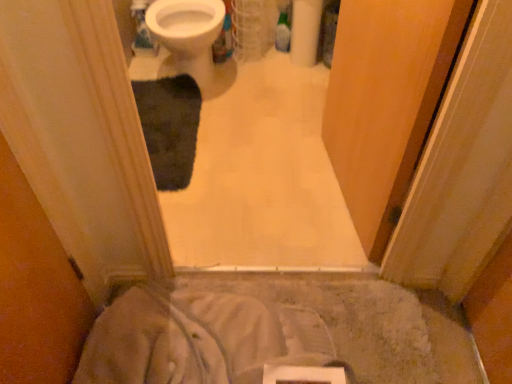
This screenshot has width=512, height=384. In order to click on free space between white glossy bidet at upper center and wooden screen door at center in this screenshot , I will do (269, 145).